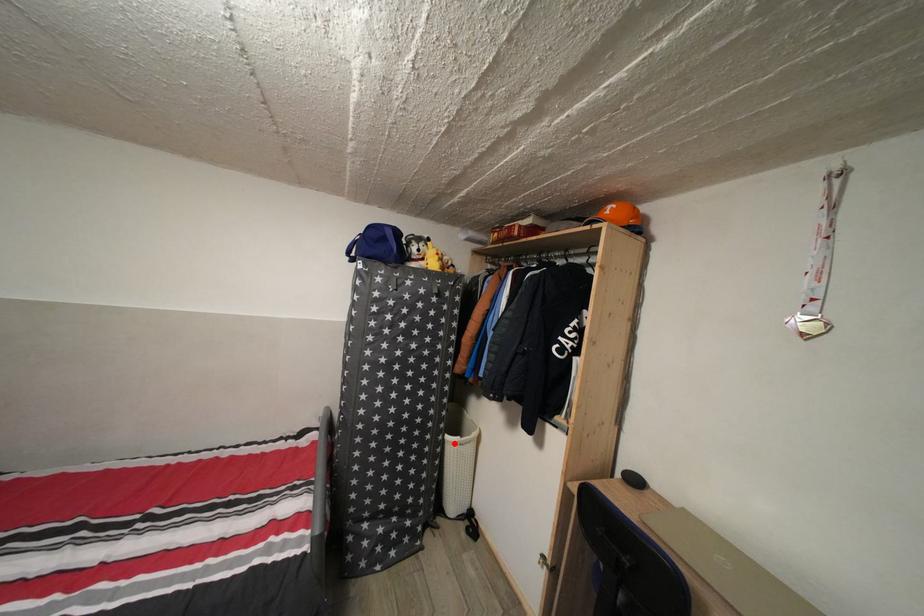
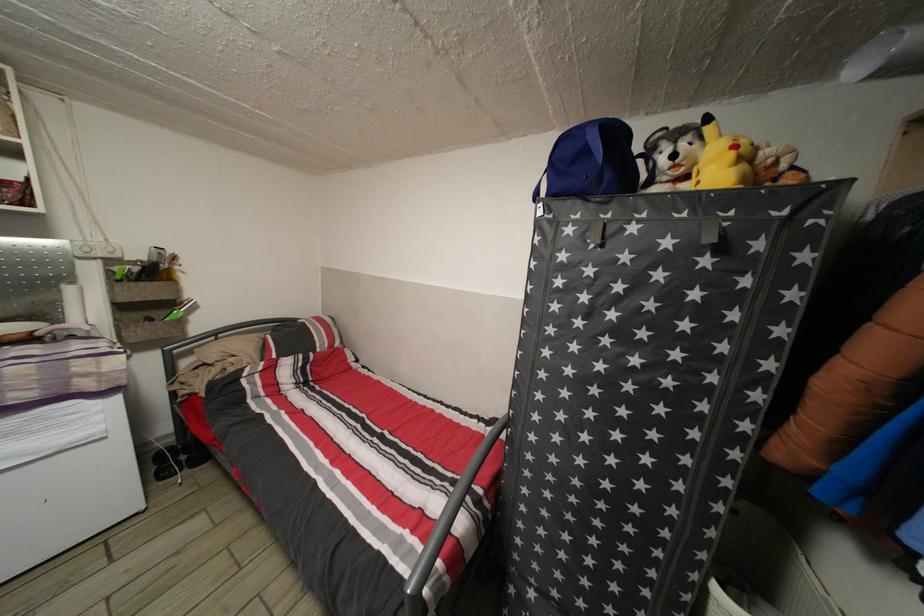
Locate, in the second image, the point that corresponds to the highlighted location in the first image.

(723, 594)